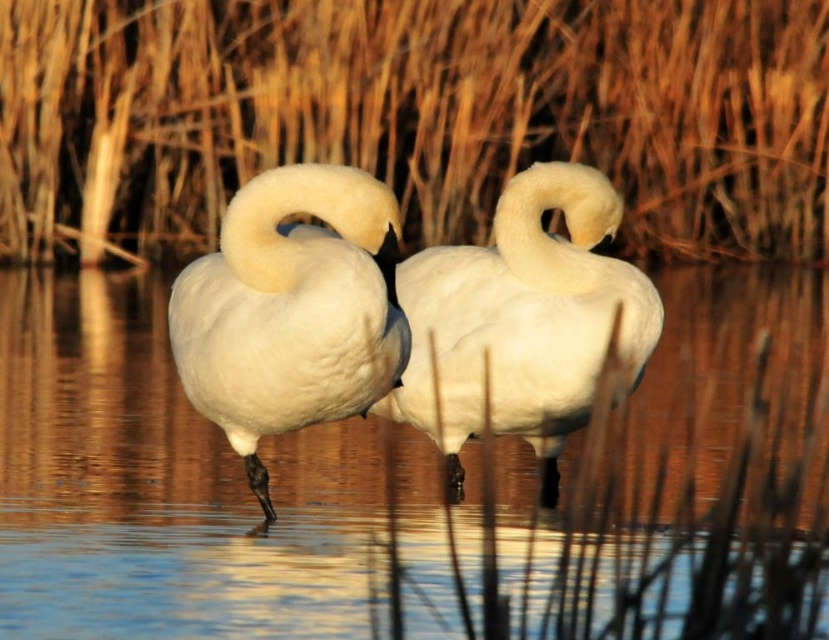
Who is taller, brown grass at center or white matte swan at center?

white matte swan at center is taller.

How much distance is there between brown grass at center and white matte swan at center?

8.28 meters

Find the location of a particular element. This screenshot has width=829, height=640. brown grass at center is located at coordinates (411, 115).

Can you confirm if clear water at center is shorter than white fluffy swan at center?

No.

Is point (730, 340) less distant than point (633, 365)?

That is False.

What are the coordinates of `clear water at center` in the screenshot? It's located at (187, 492).

Measure the distance between clear water at center and camera.

clear water at center and camera are 8.45 feet apart from each other.

Consider the image. Does clear water at center have a larger size compared to white matte swan at center?

Yes, clear water at center is bigger than white matte swan at center.

What do you see at coordinates (187, 492) in the screenshot? I see `clear water at center` at bounding box center [187, 492].

Find the location of a particular element. Image resolution: width=829 pixels, height=640 pixels. clear water at center is located at coordinates (187, 492).